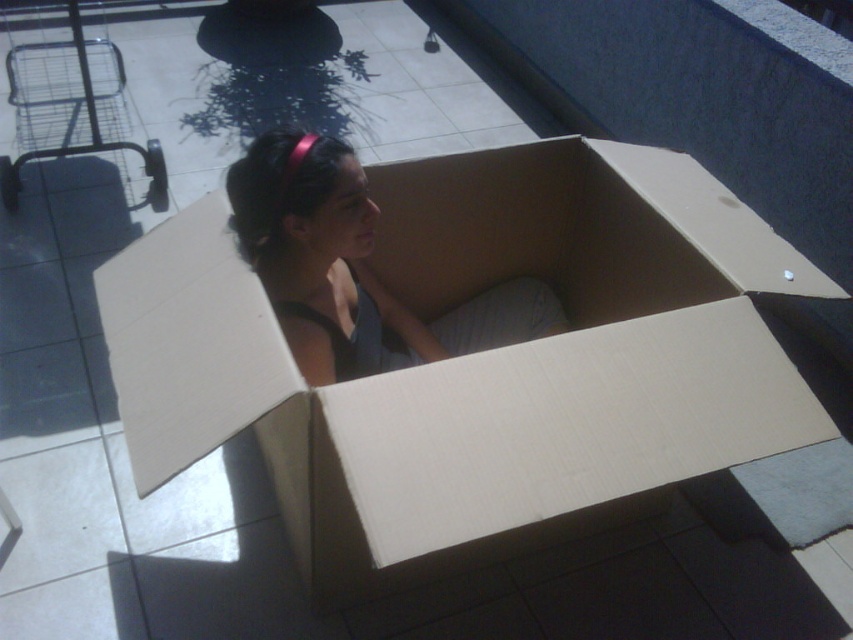
Which of these two, cardboard box at center or matte cardboard girl at center, stands taller?

cardboard box at center is taller.

Can you confirm if cardboard box at center is thinner than matte cardboard girl at center?

Incorrect, cardboard box at center's width is not less than matte cardboard girl at center's.

Identify the location of cardboard box at center. (477, 358).